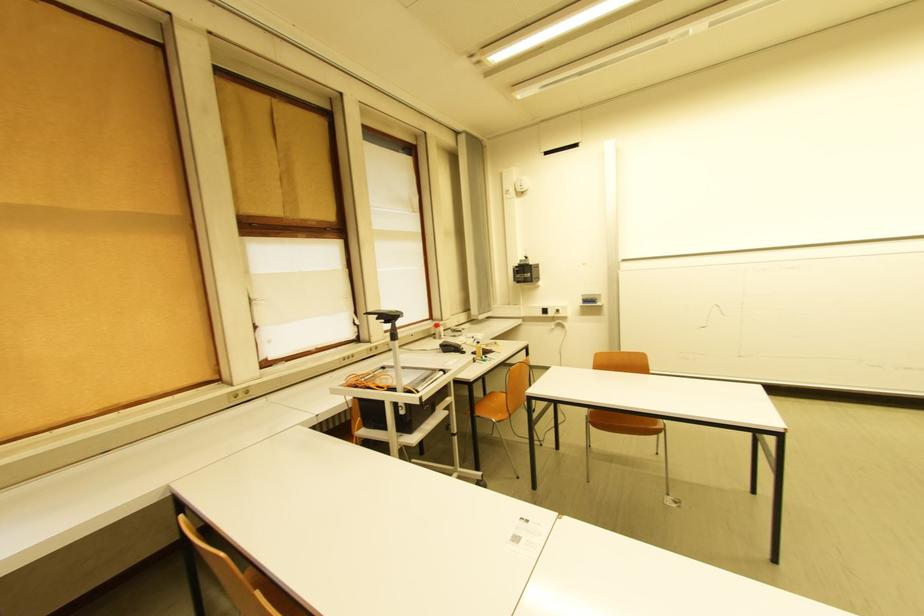
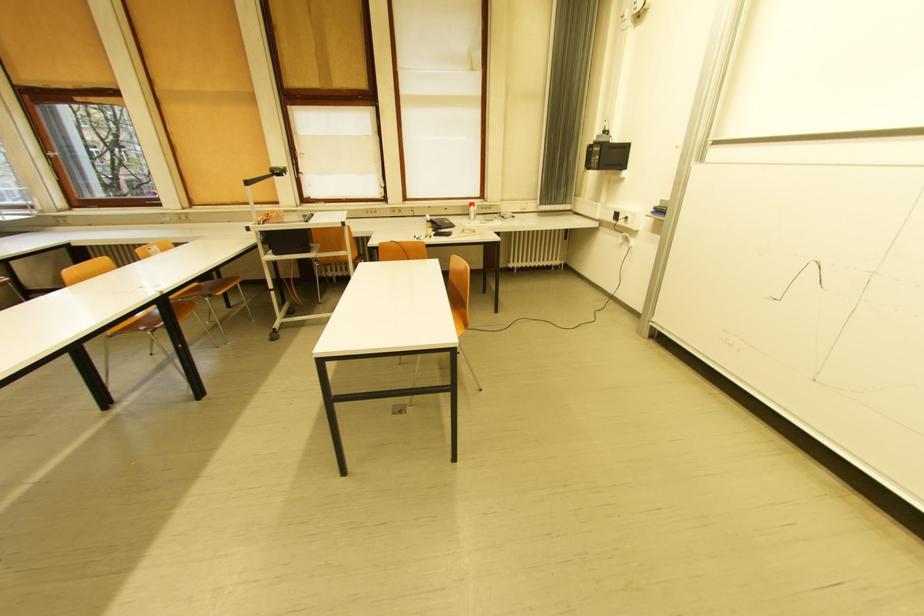
The point at (590, 302) is marked in the first image. Where is the corresponding point in the second image?

(662, 209)